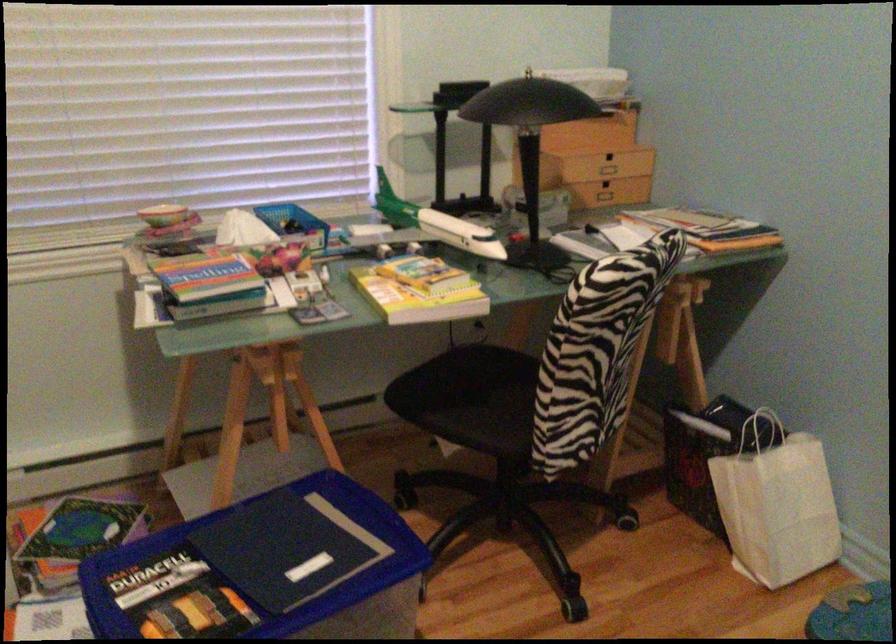
Which object does [264,570] point to?

It refers to a blue plastic basket.